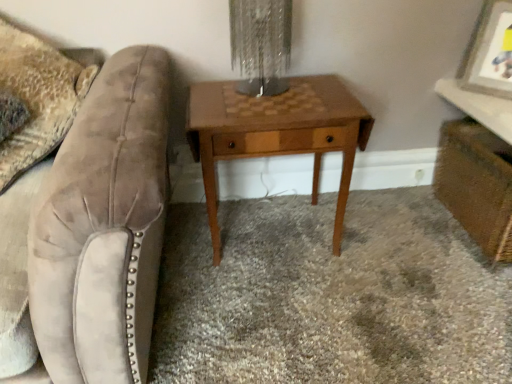
Image resolution: width=512 pixels, height=384 pixels. Find the location of `vacant area situated below woodenmaterial/texturenightstand at center (from a real-world perspective)`. vacant area situated below woodenmaterial/texturenightstand at center (from a real-world perspective) is located at coordinates coord(276,238).